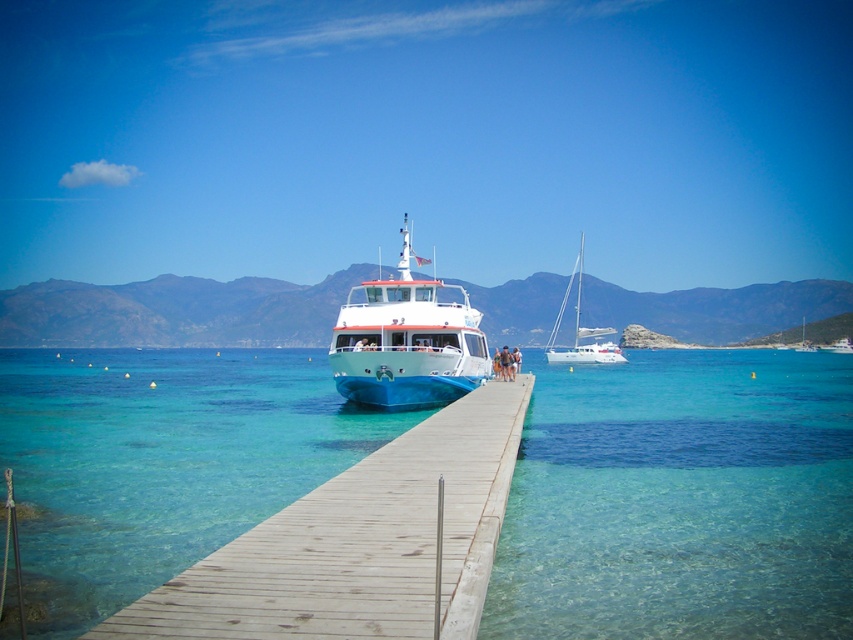
From the picture: You are standing on the wooden pier and want to take a photo of both the wooden at center and the white glossy sailboat at right. Which object should you position closer to the front of your camera frame to include both in the shot?

You should position the wooden at center closer to the front of your camera frame because it is in front of the white glossy sailboat at right, ensuring both are visible in the photo.